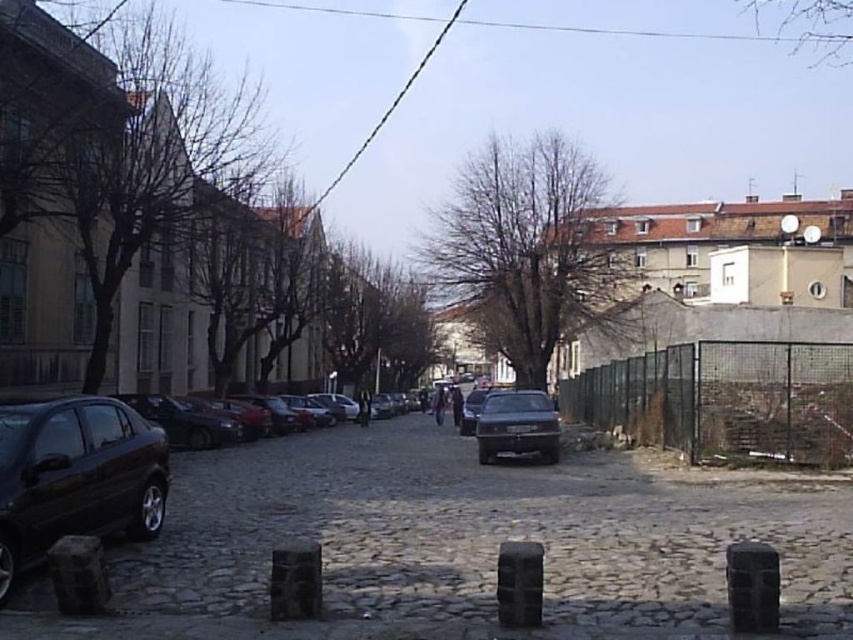
Question: Is dark gray cobblestone alley at center bigger than green wire mesh fence at right?

Choices:
 (A) no
 (B) yes

Answer: (A)

Question: Among these objects, which one is nearest to the camera?

Choices:
 (A) matte black sedan at lower left
 (B) shiny black car at center
 (C) dark gray cobblestone alley at center

Answer: (C)

Question: Which is nearer to the shiny black car at center?

Choices:
 (A) green wire mesh fence at right
 (B) dark gray cobblestone alley at center
 (C) matte black sedan at lower left

Answer: (B)

Question: Estimate the real-world distances between objects in this image. Which object is farther from the shiny black car at center?

Choices:
 (A) matte black sedan at lower left
 (B) dark gray cobblestone alley at center
 (C) green wire mesh fence at right

Answer: (A)

Question: Is green wire mesh fence at right wider than shiny black car at center?

Choices:
 (A) no
 (B) yes

Answer: (B)

Question: Observing the image, what is the correct spatial positioning of green wire mesh fence at right in reference to matte black sedan at lower left?

Choices:
 (A) above
 (B) below

Answer: (B)